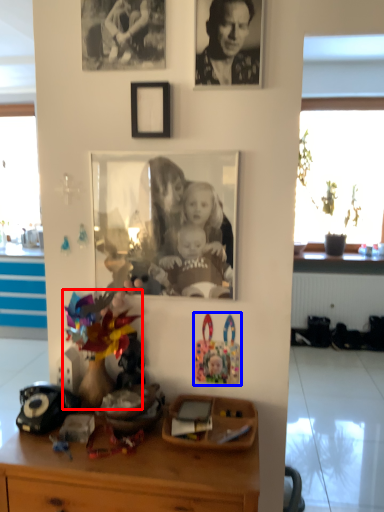
Question: Which object appears farthest to the camera in this image, toy (highlighted by a red box) or toy (highlighted by a blue box)?

Choices:
 (A) toy
 (B) toy

Answer: (B)